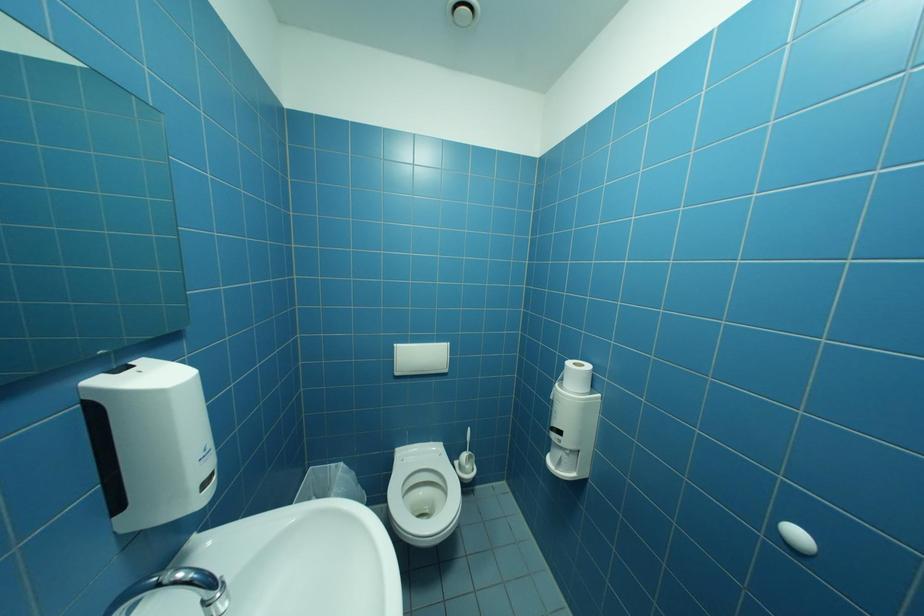
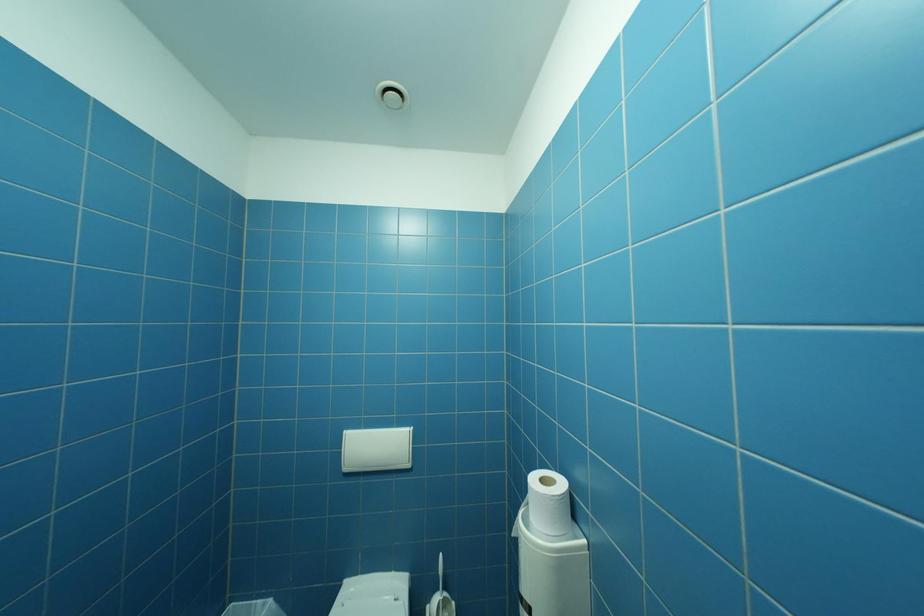
Question: Based on the continuous images, in which direction is the camera rotating? Reply with the corresponding letter.

Choices:
 (A) Left
 (B) Right
 (C) Up
 (D) Down

Answer: (C)